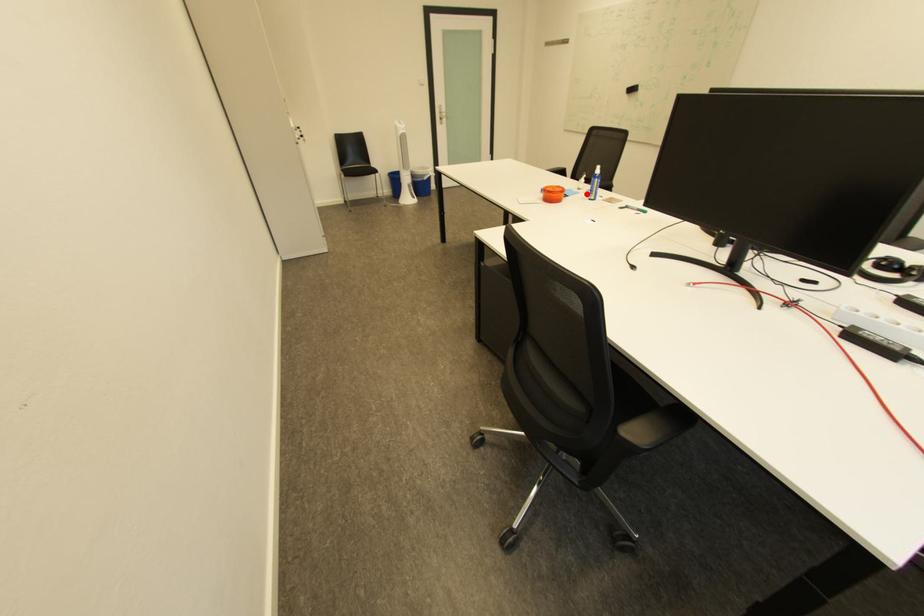
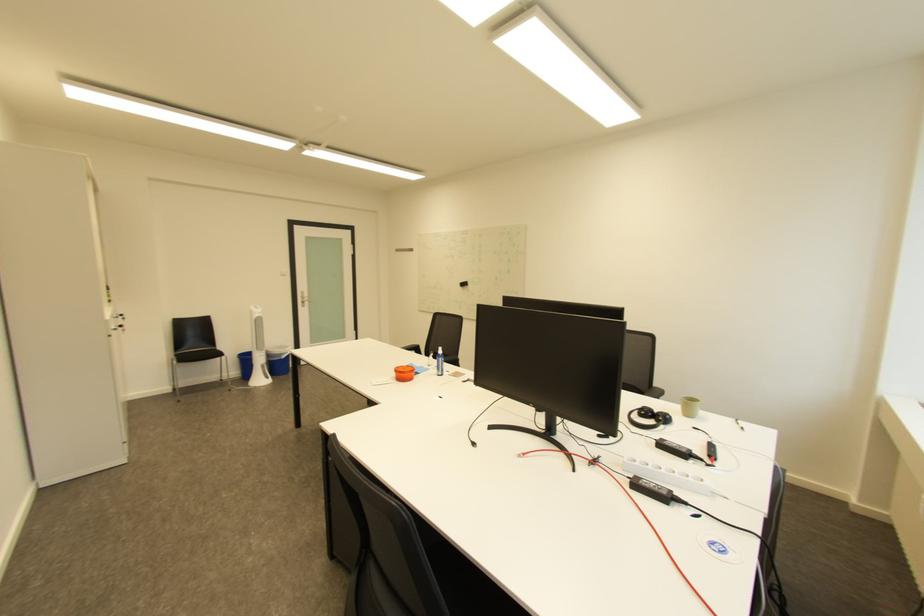
Question: A red point is marked in image1. In image2, is the corresponding 3D point closer to the camera or farther? Reply with the corresponding letter.

Choices:
 (A) The corresponding 3D point is closer.
 (B) The corresponding 3D point is farther.

Answer: (B)